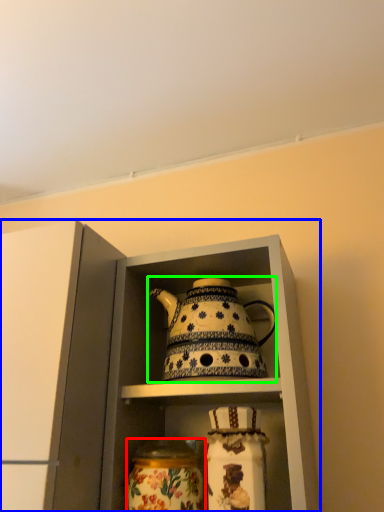
Question: Which object is positioned closest to glass vase (highlighted by a red box)? Select from cabinetry (highlighted by a blue box) and kettle (highlighted by a green box).

Choices:
 (A) cabinetry
 (B) kettle

Answer: (B)